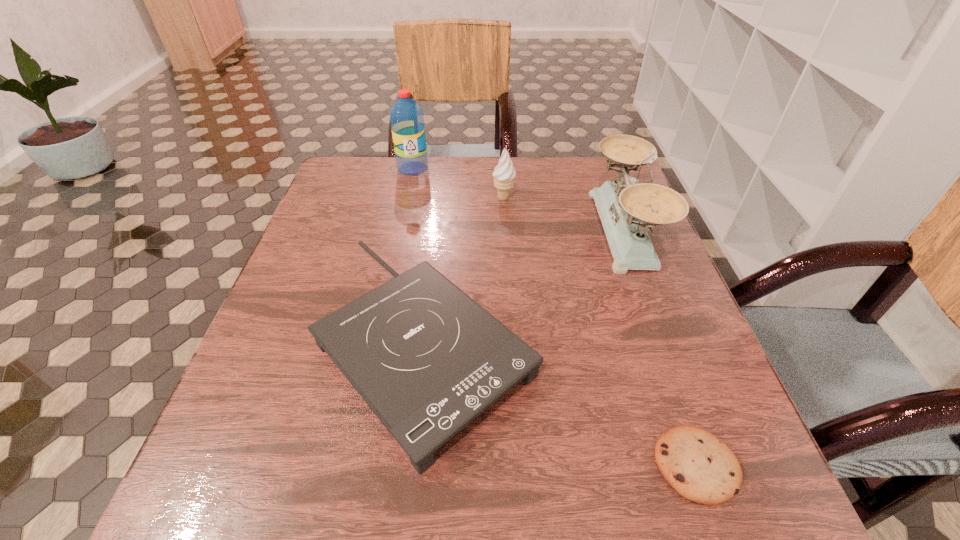
I want to click on scale at the right edge, so click(627, 211).

This screenshot has width=960, height=540. What are the coordinates of `cookie positioned at the right edge` in the screenshot? It's located at (701, 468).

Image resolution: width=960 pixels, height=540 pixels. Identify the location of object located in the near left corner section of the desktop. (427, 359).

Find the location of a particular element. The image size is (960, 540). object located in the far right corner section of the desktop is located at coordinates (627, 211).

Find the location of `object present at the near right corner`. object present at the near right corner is located at coordinates (701, 468).

At what (x,y) coordinates should I click in order to perform the action: click on free spot at the far edge of the desktop. Please return your answer as a coordinate pair (x, y). Image resolution: width=960 pixels, height=540 pixels. Looking at the image, I should click on pyautogui.click(x=491, y=169).

Image resolution: width=960 pixels, height=540 pixels. In the image, there is a desktop. In order to click on free space at the near edge in this screenshot , I will do `click(493, 516)`.

Find the location of a particular element. free space at the left edge is located at coordinates (287, 278).

Image resolution: width=960 pixels, height=540 pixels. Identify the location of vacant area at the far left corner. (386, 175).

You are a GUI agent. You are given a task and a screenshot of the screen. Output one action in this format:
    pyautogui.click(x=<x>, y=<y>)
    Task: Click on the free space at the far right corner of the desktop
    Image resolution: width=960 pixels, height=540 pixels.
    Given the screenshot: What is the action you would take?
    pyautogui.click(x=582, y=182)